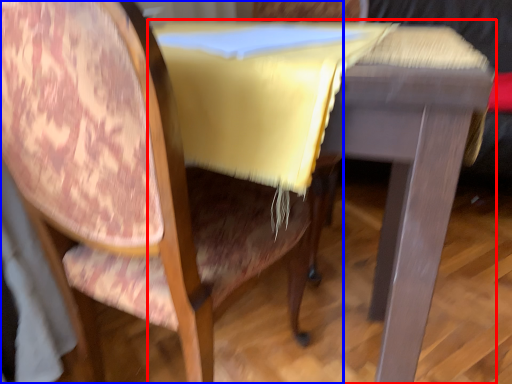
Question: Which of the following is the farthest to the observer, table (highlighted by a red box) or chair (highlighted by a blue box)?

Choices:
 (A) table
 (B) chair

Answer: (A)